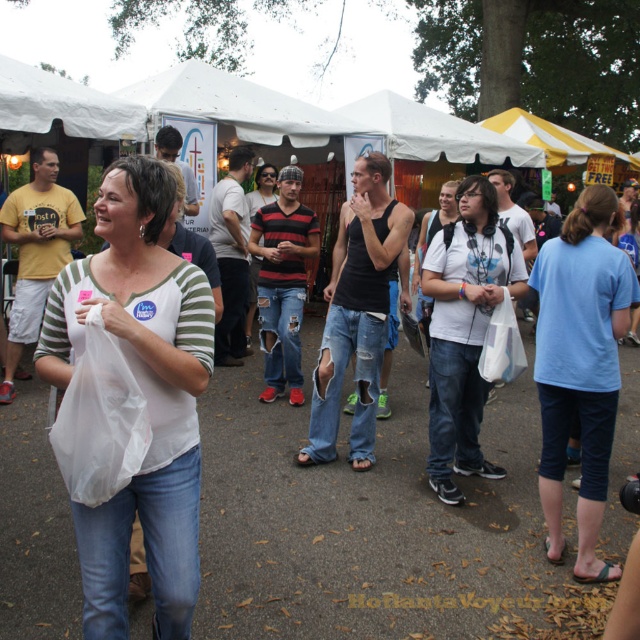
Measure the distance between light blue cotton shirt at center and white matte t-shirt at center.

They are 26.91 inches apart.

Can you confirm if light blue cotton shirt at center is thinner than white matte t-shirt at center?

Result: Correct, light blue cotton shirt at center's width is less than white matte t-shirt at center's.

Where is `light blue cotton shirt at center`? light blue cotton shirt at center is located at coordinates (580, 365).

Between white matte plastic bag at left and light blue cotton shirt at center, which one is positioned lower?

white matte plastic bag at left

Is white matte plastic bag at left above light blue cotton shirt at center?

No.

Does point (168, 552) come in front of point (554, 419)?

Yes, point (168, 552) is closer to viewer.

You are a GUI agent. You are given a task and a screenshot of the screen. Output one action in this format:
    pyautogui.click(x=<x>, y=<y>)
    Task: Click on the white matte plastic bag at left
    
    Given the screenshot: What is the action you would take?
    pyautogui.click(x=144, y=396)

Who is lower down, white matte plastic bag at left or white matte t-shirt at center?

white matte plastic bag at left

Describe the element at coordinates (144, 396) in the screenshot. I see `white matte plastic bag at left` at that location.

At what (x,y) coordinates should I click in order to perform the action: click on white matte plastic bag at left. Please return your answer as a coordinate pair (x, y). The width and height of the screenshot is (640, 640). Looking at the image, I should click on pos(144,396).

Identify the location of white matte plastic bag at left. The width and height of the screenshot is (640, 640). (144, 396).